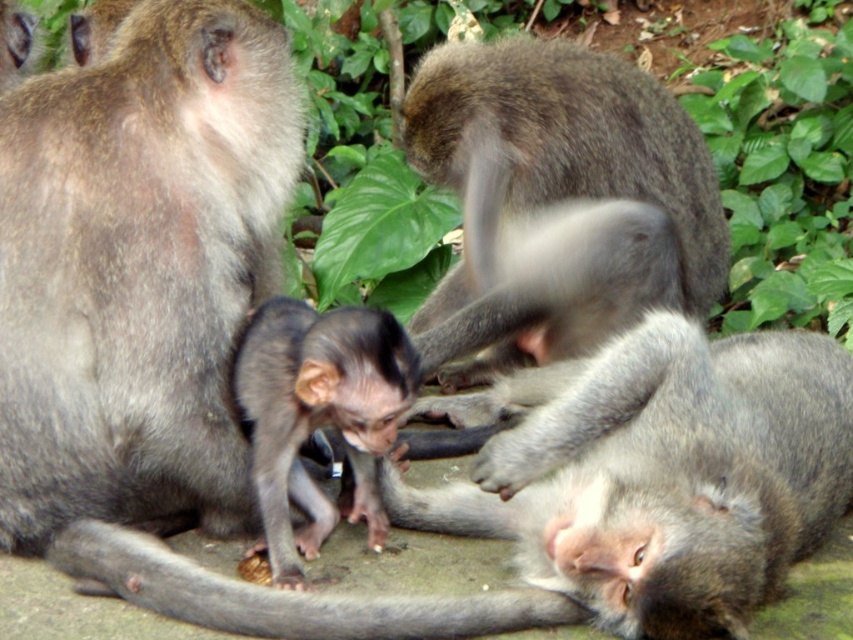
Based on the scene description, which monkey is taller between the gray fur monkey at lower right and the dark gray fur monkey at center?

The gray fur monkey at lower right is taller than the dark gray fur monkey at center.

You are a wildlife photographer trying to capture a photo of the gray fur monkey at lower right and the dark gray fur monkey at center. Since you want to ensure both monkeys are clearly visible in the frame, which monkey should you focus on first to account for their size difference?

The gray fur monkey at lower right is larger in size than the dark gray fur monkey at center. Therefore, you should focus on the gray fur monkey at lower right first since it occupies more space in the frame, making it easier to adjust the camera settings for clarity before focusing on the smaller monkey.